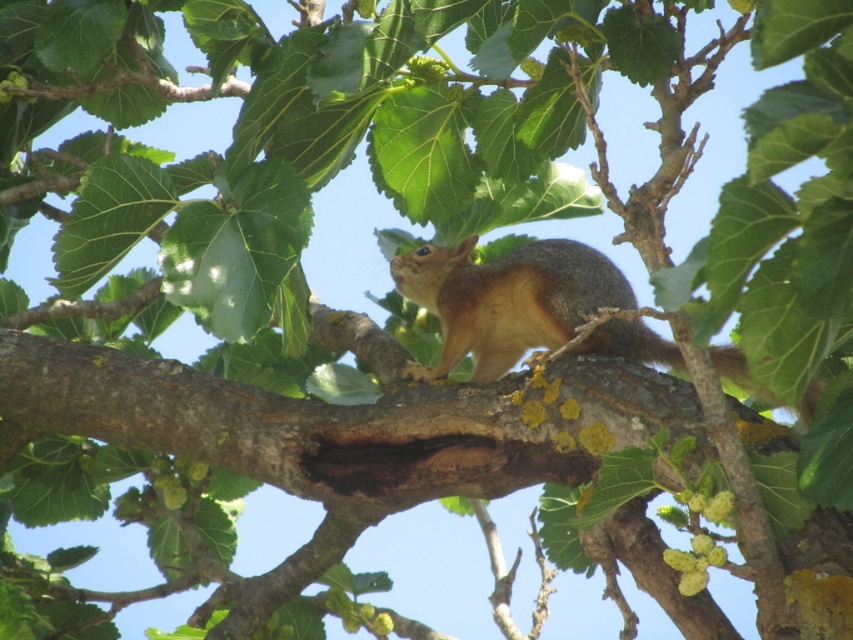
Is shiny brown fur squirrel at center below brown furry tail at right?

No, shiny brown fur squirrel at center is not below brown furry tail at right.

Which is behind, point (541, 266) or point (627, 314)?

Point (541, 266)

Between point (428, 291) and point (595, 346), which one is positioned in front?

Point (595, 346) is more forward.

I want to click on shiny brown fur squirrel at center, so click(x=506, y=300).